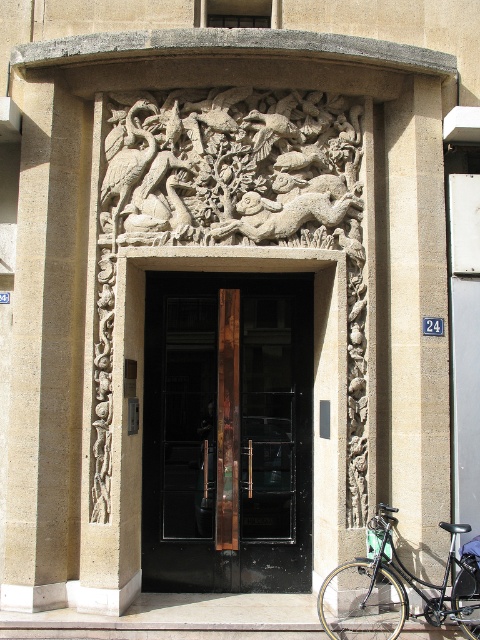
Question: Is white stone relief at center closer to the viewer compared to beige stone pillar at right?

Choices:
 (A) no
 (B) yes

Answer: (A)

Question: Which is farther from the beige stone pillar at right?

Choices:
 (A) black glass door at center
 (B) smooth stone pillar at left

Answer: (B)

Question: Which object is positioned farthest from the black matte bicycle at lower right?

Choices:
 (A) white stone relief at center
 (B) smooth stone pillar at left
 (C) beige stone pillar at right
 (D) black glass door at center

Answer: (A)

Question: Which object is closer to the camera taking this photo?

Choices:
 (A) black glass door at center
 (B) white stone relief at center
 (C) black matte bicycle at lower right
 (D) beige stone pillar at right

Answer: (C)

Question: Can you confirm if white stone relief at center is positioned to the left of beige stone pillar at right?

Choices:
 (A) no
 (B) yes

Answer: (B)

Question: Observing the image, what is the correct spatial positioning of black glass door at center in reference to white stone relief at center?

Choices:
 (A) left
 (B) right

Answer: (A)